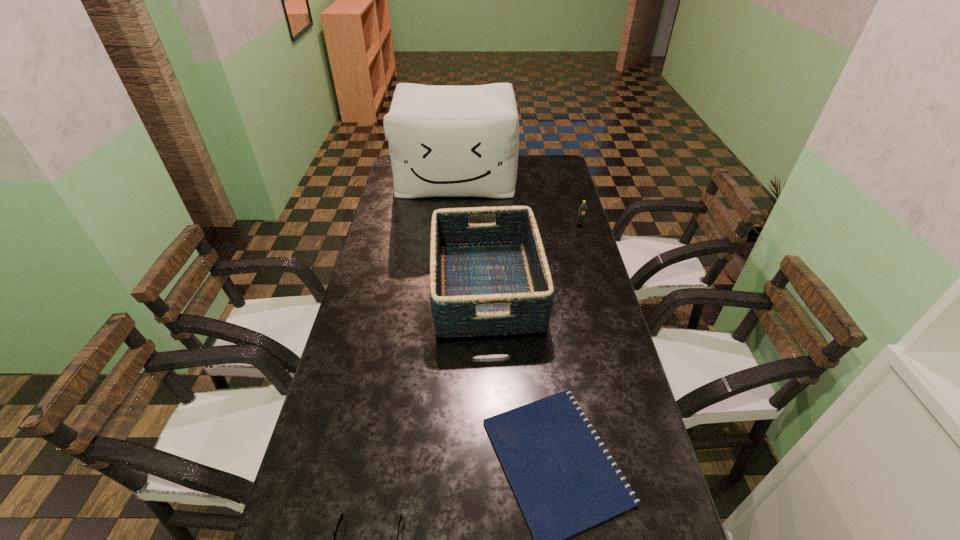
This screenshot has height=540, width=960. What are the coordinates of `object present at the left edge` in the screenshot? It's located at (444, 141).

Where is `object that is at the right edge`? object that is at the right edge is located at coordinates 583,207.

The height and width of the screenshot is (540, 960). I want to click on object that is at the far left corner, so point(444,141).

Find the location of a particular element. vacant space at the far edge is located at coordinates (522, 170).

Where is `free spot at the left edge of the desktop`? The width and height of the screenshot is (960, 540). free spot at the left edge of the desktop is located at coordinates (348, 530).

Locate an element on the screen. The height and width of the screenshot is (540, 960). vacant area at the right edge is located at coordinates pos(624,451).

This screenshot has width=960, height=540. In the image, there is a desktop. In order to click on vacant space at the far right corner in this screenshot , I will do `click(565, 167)`.

Identify the location of object identified as the closest to the shortest object. (486, 279).

Identify the location of object that is the third closest to the farthest object. (564, 484).

Locate an element on the screen. The image size is (960, 540). vacant point that satisfies the following two spatial constraints: 1. on the side of the second tallest object with the smiley face; 2. on the right side of the tallest object is located at coordinates (447, 287).